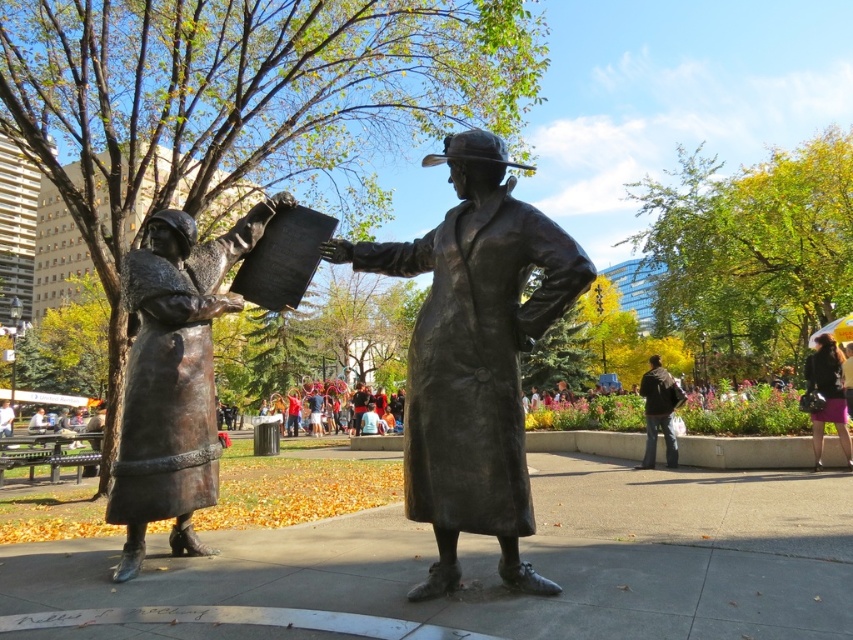
You are standing in the park and want to take a photo of the bronze statue at center. If you are currently 10 feet away from the statue, can you move closer to get a better shot?

The bronze statue at center is 9.82 feet from camera. Since you are currently 10 feet away, moving closer would require stepping within the 9.82 feet distance, which is possible to get a better shot.

You are a photographer trying to capture both the bronze statue at left and the dark brown leather jacket at lower right in a single frame. Based on their positions, which object should you position closer to the left side of your camera frame?

You should position the bronze statue at left closer to the left side of your camera frame since it is already to the left of the dark brown leather jacket at lower right.

You are a photographer wanting to capture both the bronze statue at center and the matte black jacket at lower right in a single frame. Given that your camera can only focus on objects within a 3.5 meter width, can you fit both objects into the frame without moving?

The bronze statue at center is wider than the matte black jacket at lower right. However, since the camera can focus on objects within a 3.5 meter width, the total width of both objects combined must be less than or equal to 3.5 meters. Unfortunately, the exact widths of the objects are not provided, so it is impossible to determine if they can fit within the frame without additional information.